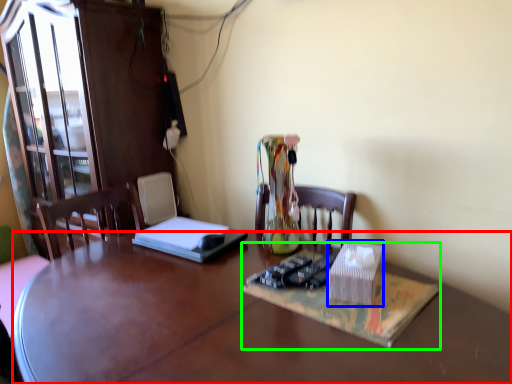
Question: Which object is positioned farthest from desk (highlighted by a red box)? Select from cardboard box (highlighted by a blue box) and book (highlighted by a green box).

Choices:
 (A) cardboard box
 (B) book

Answer: (A)